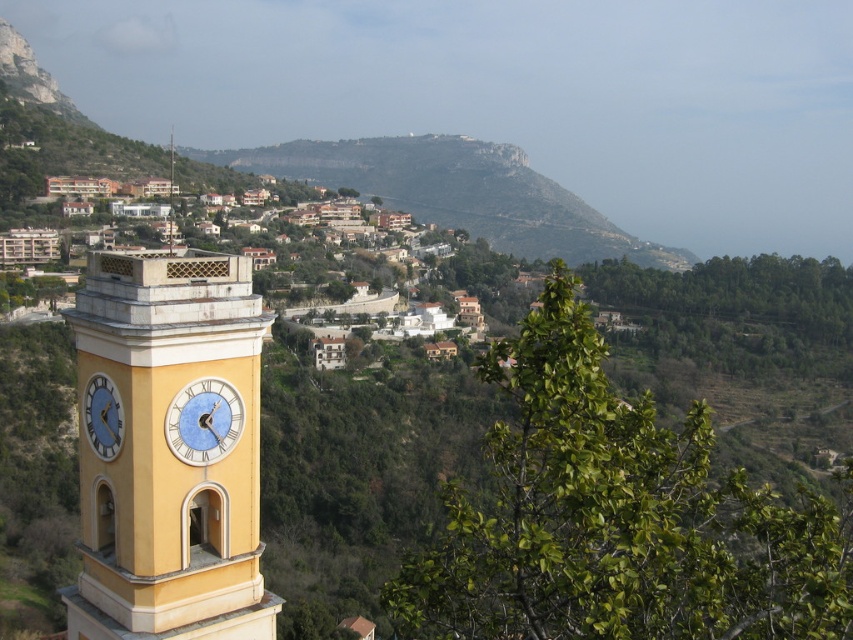
Question: Which point is farther from the camera taking this photo?

Choices:
 (A) (547, 241)
 (B) (201, 426)
 (C) (86, 602)

Answer: (A)

Question: Which point is farther from the camera taking this photo?

Choices:
 (A) (202, 156)
 (B) (103, 420)
 (C) (144, 412)

Answer: (A)

Question: Which object is the closest to the white glossy clock at left?

Choices:
 (A) yellow painted stone clock tower at left
 (B) green rocky mountain at upper center
 (C) blue glass clock at center

Answer: (A)

Question: Can you confirm if yellow painted stone clock tower at left is positioned to the left of green rocky mountain at upper center?

Choices:
 (A) yes
 (B) no

Answer: (A)

Question: Does blue glass clock at center appear under white glossy clock at left?

Choices:
 (A) no
 (B) yes

Answer: (B)

Question: Does green rocky mountain at upper center appear under blue glass clock at center?

Choices:
 (A) yes
 (B) no

Answer: (B)